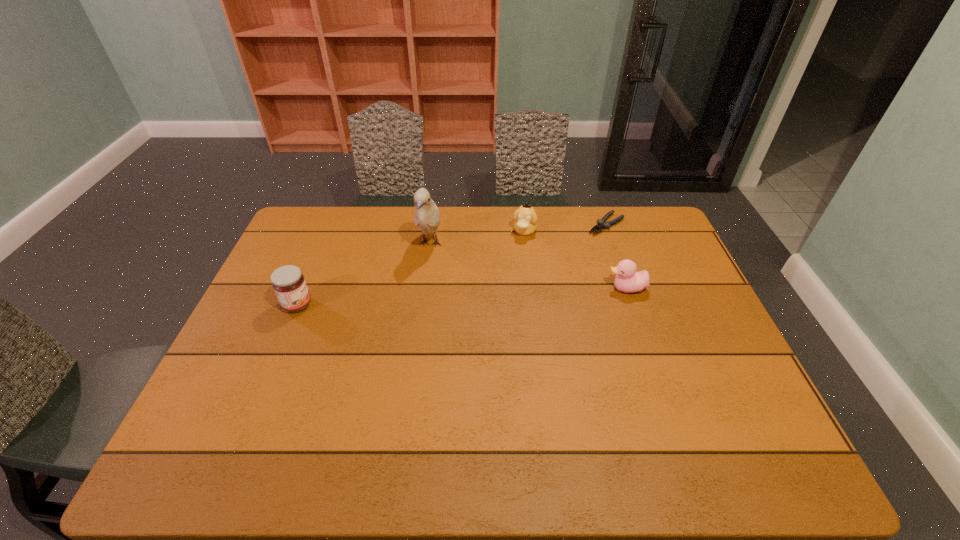
Find the location of a particular element. This screenshot has width=960, height=540. free space that is in between the farther duckling and the pliers is located at coordinates (565, 228).

Identify the location of vacant area that lies between the jam and the pliers. This screenshot has width=960, height=540. [452, 265].

Locate an element on the screen. free spot between the right duckling and the tallest object is located at coordinates (528, 266).

Where is `the fourth closest object to the jam`? The image size is (960, 540). the fourth closest object to the jam is located at coordinates (601, 225).

Locate an element on the screen. The width and height of the screenshot is (960, 540). the fourth closest object to the fourth object from right to left is located at coordinates (627, 280).

The width and height of the screenshot is (960, 540). What are the coordinates of `free space that satisfies the following two spatial constraints: 1. on the front side of the bird; 2. on the front-facing side of the nearer duckling` in the screenshot? It's located at (424, 288).

This screenshot has width=960, height=540. I want to click on blank area in the image that satisfies the following two spatial constraints: 1. on the back side of the pliers; 2. on the left side of the third object from left to right, so click(524, 224).